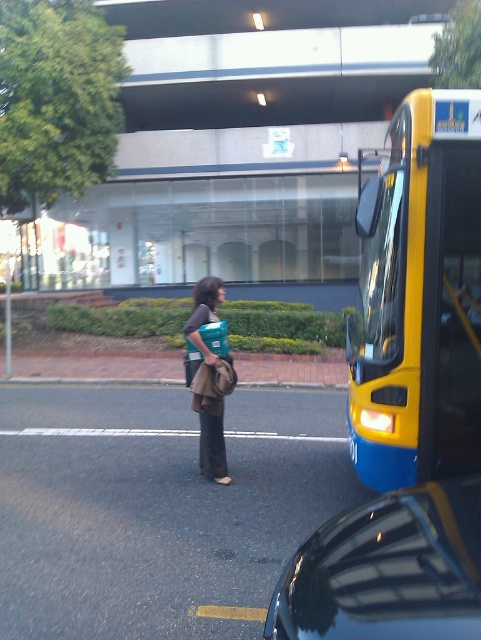
You are a pedestrian standing at the center of the sidewalk. You need to cross the street to reach the teal bag the woman is holding. The bus is parked at yellow matte bus at right. Is the bus blocking your path to the teal bag?

The yellow matte bus at right is located at point (418, 298), which is to the right side of the image. Since you are at the center of the sidewalk and the woman with the teal bag is near the edge of the road, the bus is not directly blocking your path to the teal bag unless you need to go around it. However, based on the coordinates provided, the bus is positioned to the right, so your path to the woman should be clear unless there are other obstacles not mentioned.

You are a pedestrian trying to cross the street. You see the yellow matte bus at right and the shiny black car at lower right. Which vehicle takes up more space on the road?

The shiny black car at lower right takes up more space on the road than the yellow matte bus at right.

You are a pedestrian standing at the edge of the sidewalk where the woman is. You want to cross the street to reach the shiny black car at lower right. Is the yellow matte bus at right blocking your path?

The yellow matte bus at right is further to the viewer than the shiny black car at lower right, so the bus is closer to you. This means the bus is blocking your path to the shiny black car at lower right.